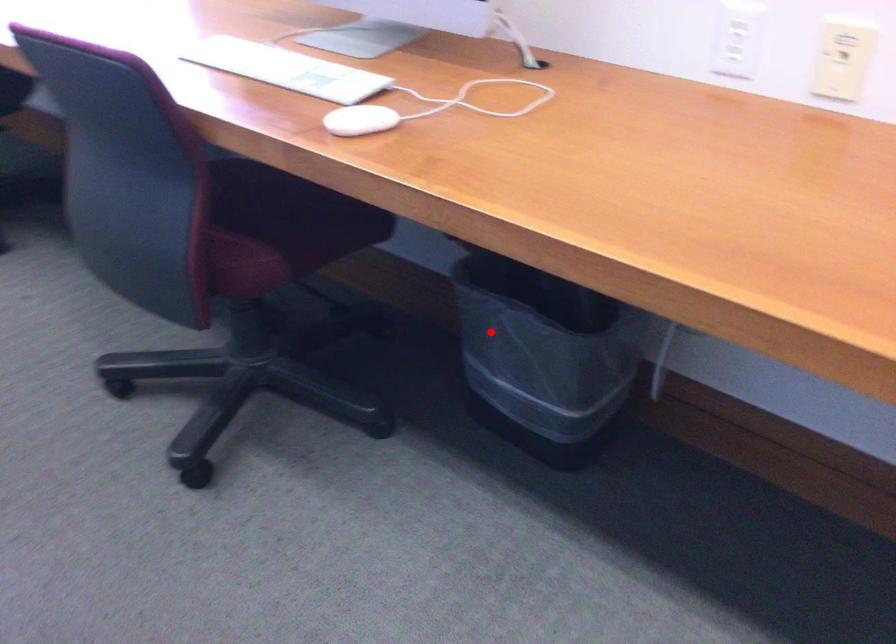
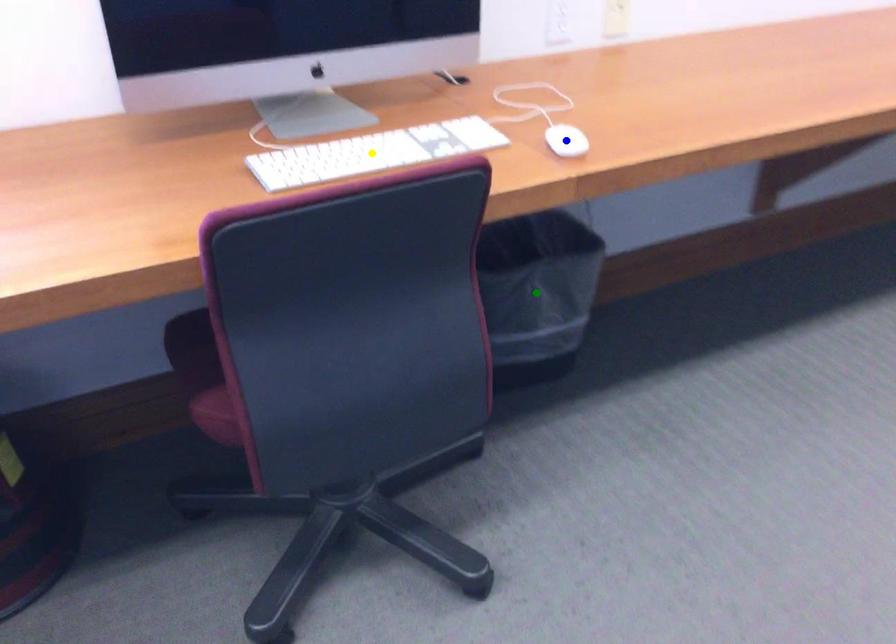
Question: I am providing you with two images of the same scene from different viewpoints. A red point is marked on the first image. You are given multiple points on the second image. Can you choose the point in image 2 that corresponds to the point in image 1?

Choices:
 (A) yellow point
 (B) blue point
 (C) green point

Answer: (C)